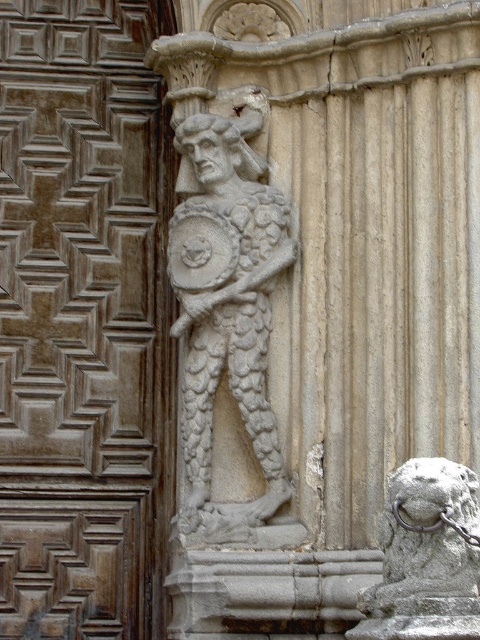
Question: Is brown wood door at center thinner than gray stone lion at lower right?

Choices:
 (A) yes
 (B) no

Answer: (B)

Question: Which point is closer to the camera?

Choices:
 (A) carved stone warrior at center
 (B) gray stone lion at lower right

Answer: (B)

Question: Can you confirm if brown wood door at center is positioned below carved stone warrior at center?

Choices:
 (A) no
 (B) yes

Answer: (A)

Question: Among these points, which one is nearest to the camera?

Choices:
 (A) (275, 211)
 (B) (475, 592)
 (C) (14, 464)

Answer: (B)

Question: Which object is the farthest from the carved stone warrior at center?

Choices:
 (A) brown wood door at center
 (B) gray stone lion at lower right

Answer: (B)

Question: Is brown wood door at center positioned in front of gray stone lion at lower right?

Choices:
 (A) yes
 (B) no

Answer: (B)